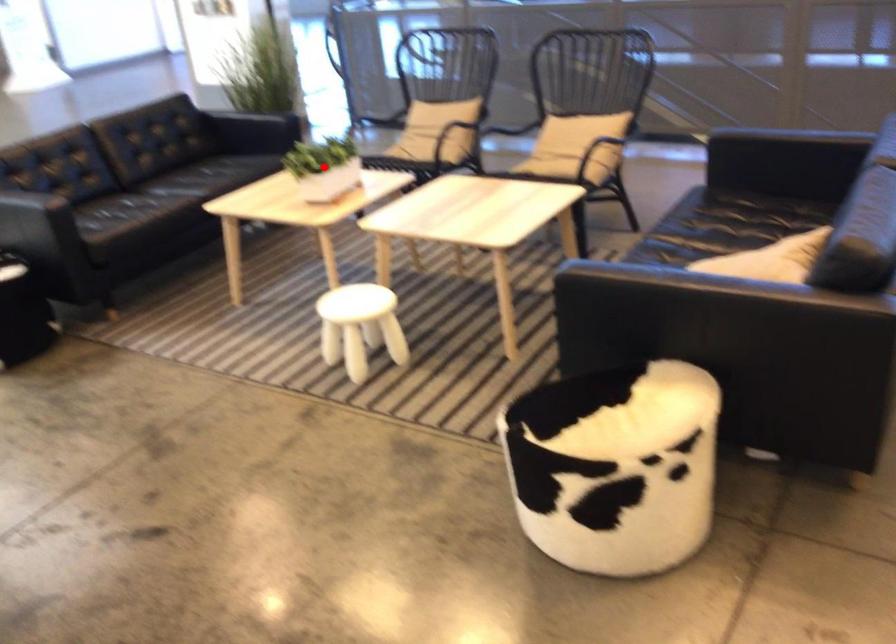
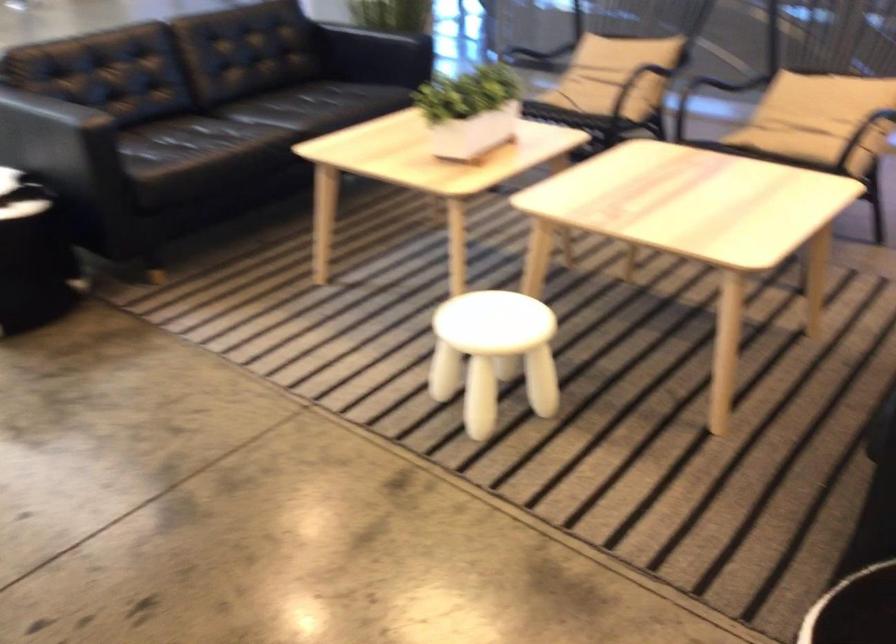
In the second image, find the point that corresponds to the highlighted location in the first image.

(470, 111)